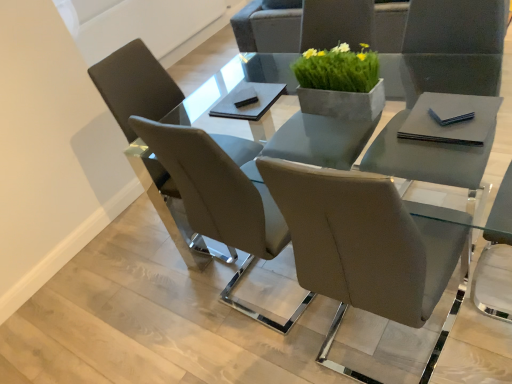
Question: Which direction should I rotate to look at matte gray chair at center, acting as the first chair starting from the front?

Choices:
 (A) right
 (B) left

Answer: (B)

Question: Is green concrete planter at center shorter than matte gray chair at left, the 2th chair viewed from the front?

Choices:
 (A) no
 (B) yes

Answer: (B)

Question: Considering the relative positions of green concrete planter at center and matte gray chair at left, which ranks as the 1th chair in back-to-front order, in the image provided, is green concrete planter at center to the right of matte gray chair at left, which ranks as the 1th chair in back-to-front order, from the viewer's perspective?

Choices:
 (A) yes
 (B) no

Answer: (A)

Question: Can we say green concrete planter at center lies outside matte gray chair at left, the 2th chair viewed from the front?

Choices:
 (A) no
 (B) yes

Answer: (B)

Question: From the image's perspective, is green concrete planter at center located above matte gray chair at left, the 2th chair viewed from the front?

Choices:
 (A) no
 (B) yes

Answer: (B)

Question: Is green concrete planter at center far away from matte gray chair at left, the 2th chair viewed from the front?

Choices:
 (A) yes
 (B) no

Answer: (B)

Question: From a real-world perspective, is green concrete planter at center located higher than matte gray chair at left, which ranks as the 1th chair in back-to-front order?

Choices:
 (A) yes
 (B) no

Answer: (A)

Question: Is matte gray chair at center, the 2th chair positioned from the back, positioned in front of matte gray chair at left, the 2th chair viewed from the front?

Choices:
 (A) no
 (B) yes

Answer: (B)

Question: Is matte gray chair at center, acting as the first chair starting from the front, to the left of matte gray chair at left, which ranks as the 1th chair in back-to-front order, from the viewer's perspective?

Choices:
 (A) yes
 (B) no

Answer: (B)

Question: Could matte gray chair at left, the 2th chair viewed from the front, be considered to be inside matte gray chair at center, the 2th chair positioned from the back?

Choices:
 (A) no
 (B) yes

Answer: (A)

Question: Considering the relative positions of matte gray chair at center, acting as the first chair starting from the front, and matte gray chair at left, which ranks as the 1th chair in back-to-front order, in the image provided, is matte gray chair at center, acting as the first chair starting from the front, behind matte gray chair at left, which ranks as the 1th chair in back-to-front order,?

Choices:
 (A) yes
 (B) no

Answer: (B)

Question: Considering the relative sizes of matte gray chair at center, acting as the first chair starting from the front, and matte gray chair at left, the 2th chair viewed from the front, in the image provided, is matte gray chair at center, acting as the first chair starting from the front, taller than matte gray chair at left, the 2th chair viewed from the front,?

Choices:
 (A) no
 (B) yes

Answer: (B)

Question: Could you tell me if matte gray chair at center, acting as the first chair starting from the front, is facing matte gray chair at left, which ranks as the 1th chair in back-to-front order?

Choices:
 (A) yes
 (B) no

Answer: (B)

Question: Considering the relative sizes of green concrete planter at center and clear glass table at center in the image provided, is green concrete planter at center shorter than clear glass table at center?

Choices:
 (A) yes
 (B) no

Answer: (A)